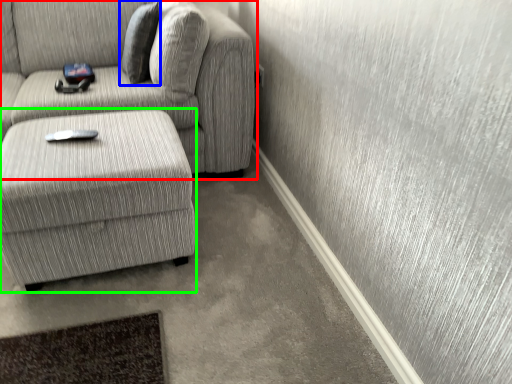
Question: Which is nearer to the studio couch (highlighted by a red box)? pillow (highlighted by a blue box) or table (highlighted by a green box).

Choices:
 (A) pillow
 (B) table

Answer: (A)